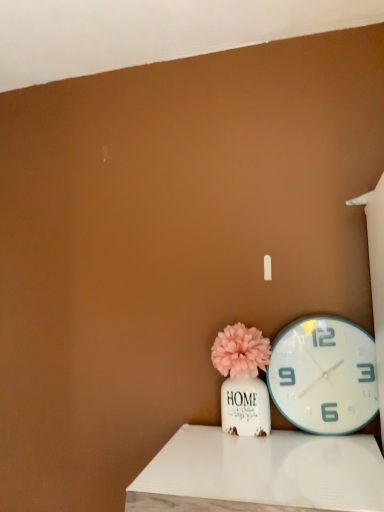
At what (x,y) coordinates should I click in order to perform the action: click on white wood table at lower center. Please return your answer as a coordinate pair (x, y). This screenshot has height=512, width=384. Looking at the image, I should click on (260, 473).

Image resolution: width=384 pixels, height=512 pixels. Identify the location of white plastic wall clock at right. (324, 375).

From the image's perspective, which one is positioned higher, white wood table at lower center or white plastic wall clock at right?

white plastic wall clock at right.

Consider the image. Which is more to the right, white wood table at lower center or white plastic wall clock at right?

white plastic wall clock at right.

Who is bigger, white wood table at lower center or white plastic wall clock at right?

white wood table at lower center.

Is white wood table at lower center looking in the opposite direction of white plastic wall clock at right?

No, white plastic wall clock at right is not at the back of white wood table at lower center.

From the image's perspective, does white plastic wall clock at right appear lower than white wood table at lower center?

No.

Is the depth of white plastic wall clock at right greater than that of white wood table at lower center?

Yes, white plastic wall clock at right is behind white wood table at lower center.

Can you confirm if white plastic wall clock at right is shorter than white wood table at lower center?

Incorrect, the height of white plastic wall clock at right does not fall short of that of white wood table at lower center.

In terms of size, does white wood table at lower center appear bigger or smaller than matte pink pom-pom at center?

In the image, white wood table at lower center appears to be larger than matte pink pom-pom at center.

How different are the orientations of white wood table at lower center and matte pink pom-pom at center in degrees?

There is a 1.7-degree angle between the facing directions of white wood table at lower center and matte pink pom-pom at center.

Is point (345, 487) more distant than point (229, 346)?

No, (345, 487) is in front of (229, 346).

From a real-world perspective, is white wood table at lower center physically above matte pink pom-pom at center?

Incorrect, from a real-world perspective, white wood table at lower center is lower than matte pink pom-pom at center.

In terms of height, does matte pink pom-pom at center look taller or shorter compared to white plastic wall clock at right?

In the image, matte pink pom-pom at center appears to be shorter than white plastic wall clock at right.

This screenshot has height=512, width=384. I want to click on floral arrangement below the white plastic wall clock at right (from a real-world perspective), so click(243, 380).

Is matte pink pom-pom at center bigger or smaller than white plastic wall clock at right?

matte pink pom-pom at center is bigger than white plastic wall clock at right.

Which object is wider, matte pink pom-pom at center or white wood table at lower center?

With larger width is white wood table at lower center.

Is matte pink pom-pom at center far away from white wood table at lower center?

Actually, matte pink pom-pom at center and white wood table at lower center are a little close together.

The image size is (384, 512). Find the location of `table beneath the matte pink pom-pom at center (from a real-world perspective)`. table beneath the matte pink pom-pom at center (from a real-world perspective) is located at coordinates (260, 473).

Is white plastic wall clock at right aimed at matte pink pom-pom at center?

No, white plastic wall clock at right is not oriented towards matte pink pom-pom at center.

From a real-world perspective, is white plastic wall clock at right physically located above or below matte pink pom-pom at center?

white plastic wall clock at right is situated higher than matte pink pom-pom at center in the real world.

Considering the relative sizes of white plastic wall clock at right and matte pink pom-pom at center in the image provided, is white plastic wall clock at right smaller than matte pink pom-pom at center?

Yes.

Based on the photo, which is more to the left, white plastic wall clock at right or matte pink pom-pom at center?

From the viewer's perspective, matte pink pom-pom at center appears more on the left side.

Identify the location of wall clock behind the white wood table at lower center. (324, 375).

Locate an element on the screen. The height and width of the screenshot is (512, 384). wall clock above the white wood table at lower center (from a real-world perspective) is located at coordinates (324, 375).

When comparing their distances from white plastic wall clock at right, does white wood table at lower center or matte pink pom-pom at center seem closer?

matte pink pom-pom at center is positioned closer to the anchor white plastic wall clock at right.

Based on their spatial positions, is matte pink pom-pom at center or white plastic wall clock at right further from white wood table at lower center?

Based on the image, white plastic wall clock at right appears to be further to white wood table at lower center.

Which object lies nearer to the anchor point matte pink pom-pom at center, white wood table at lower center or white plastic wall clock at right?

The object closer to matte pink pom-pom at center is white plastic wall clock at right.

Estimate the real-world distances between objects in this image. Which object is further from white wood table at lower center, white plastic wall clock at right or matte pink pom-pom at center?

white plastic wall clock at right lies further to white wood table at lower center than the other object.

Considering their positions, is white plastic wall clock at right positioned further to matte pink pom-pom at center than white wood table at lower center?

white wood table at lower center is positioned further to the anchor matte pink pom-pom at center.

Looking at the image, which one is located closer to white plastic wall clock at right, matte pink pom-pom at center or white wood table at lower center?

matte pink pom-pom at center is positioned closer to the anchor white plastic wall clock at right.

Identify the location of wall clock positioned between white wood table at lower center and matte pink pom-pom at center from near to far. This screenshot has width=384, height=512. (324, 375).